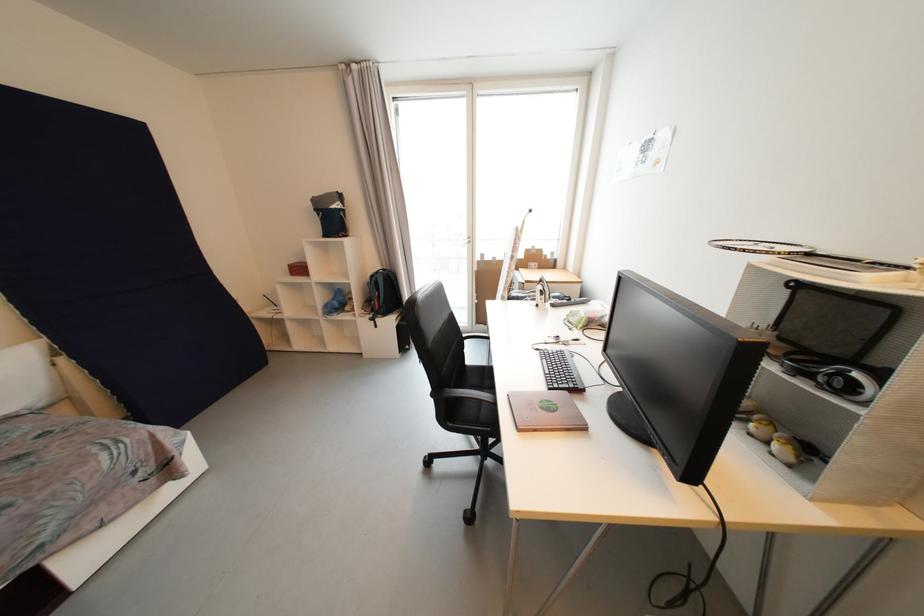
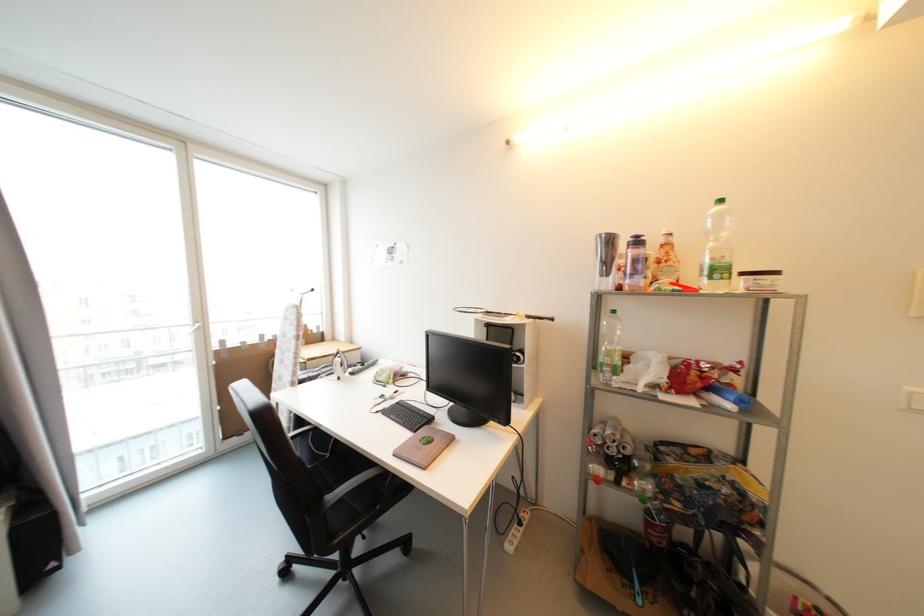
Question: The images are taken continuously from a first-person perspective. In which direction is your viewpoint rotating?

Choices:
 (A) Left
 (B) Right
 (C) Up
 (D) Down

Answer: (B)